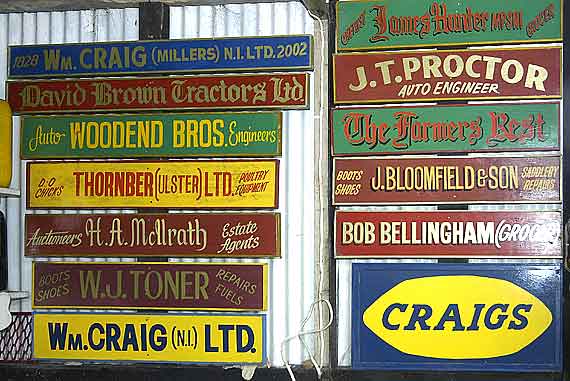
Locate an element on the screen. corrugated wall is located at coordinates (239, 22).